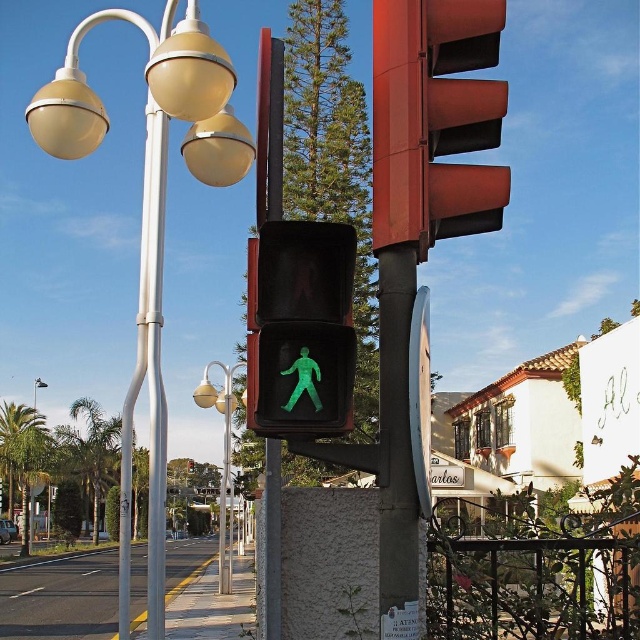
Is metallic red traffic light at upper center bigger than metallic street light at center?

Incorrect, metallic red traffic light at upper center is not larger than metallic street light at center.

Between point (483, 170) and point (216, 394), which one is positioned behind?

The point (216, 394) is behind.

Is point (392, 48) closer to viewer compared to point (225, 419)?

Yes, point (392, 48) is closer to viewer.

Identify the location of metallic red traffic light at upper center. The width and height of the screenshot is (640, 640). (435, 120).

Does green plastic pedestrian at center have a lesser height compared to matte yellow street light at upper left?

Indeed, green plastic pedestrian at center has a lesser height compared to matte yellow street light at upper left.

Is point (273, 275) farther from camera compared to point (35, 403)?

No, it is in front of (35, 403).

Between point (253, 250) and point (35, 404), which one is positioned in front?

Positioned in front is point (253, 250).

The width and height of the screenshot is (640, 640). I want to click on green plastic pedestrian at center, so pyautogui.click(x=300, y=328).

Who is taller, matte yellow street light at upper left or green matte pedestrian signal at center?

matte yellow street light at upper left is taller.

Does matte yellow street light at upper left appear on the right side of green matte pedestrian signal at center?

Incorrect, matte yellow street light at upper left is not on the right side of green matte pedestrian signal at center.

Is point (38, 378) closer to viewer compared to point (188, 470)?

No, it is behind (188, 470).

The width and height of the screenshot is (640, 640). Identify the location of matte yellow street light at upper left. (36, 388).